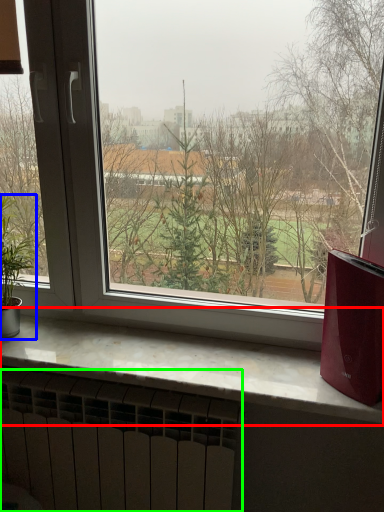
Question: Which is farther away from window sill (highlighted by a red box)? houseplant (highlighted by a blue box) or radiator (highlighted by a green box)?

Choices:
 (A) houseplant
 (B) radiator

Answer: (A)